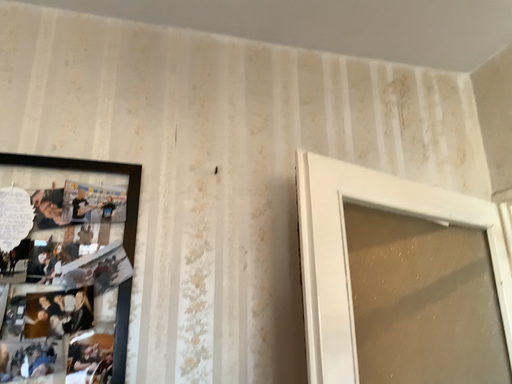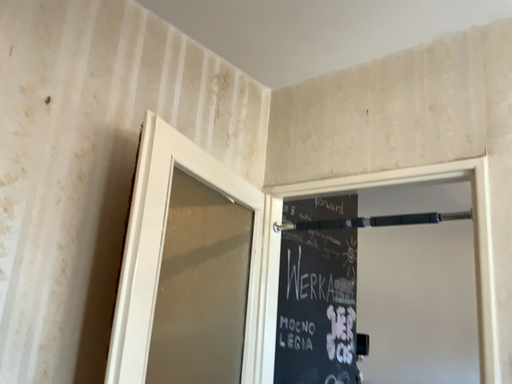
Question: How did the camera likely rotate when shooting the video?

Choices:
 (A) rotated right
 (B) rotated left

Answer: (A)